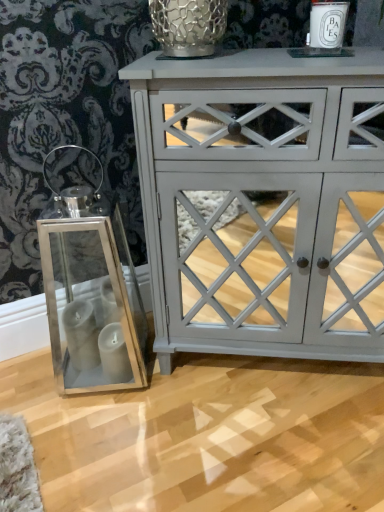
Image resolution: width=384 pixels, height=512 pixels. I want to click on vacant area that is in front of matte gray cabinet at center, so click(x=271, y=443).